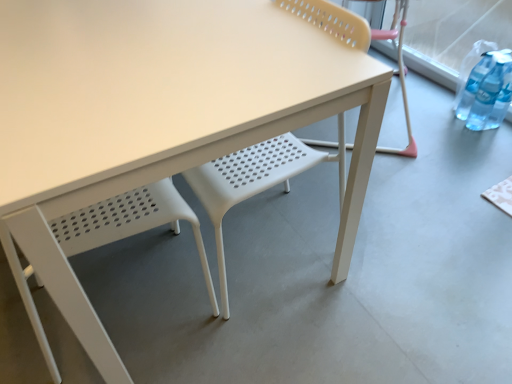
This screenshot has height=384, width=512. What do you see at coordinates (399, 75) in the screenshot?
I see `matte plastic chair at right, acting as the 2th chair starting from the left` at bounding box center [399, 75].

This screenshot has width=512, height=384. In order to click on matte plastic chair at right, acting as the 2th chair starting from the left in this screenshot , I will do `click(399, 75)`.

The image size is (512, 384). What do you see at coordinates (118, 238) in the screenshot?
I see `white plastic chair at lower left, which ranks as the 2th chair in back-to-front order` at bounding box center [118, 238].

Find the location of a particular element. The image size is (512, 384). white plastic chair at lower left, positioned as the 1th chair in bottom-to-top order is located at coordinates (118, 238).

This screenshot has width=512, height=384. Identify the location of matte plastic chair at right, the 1th chair in the right-to-left sequence. (399, 75).

Can you confirm if matte plastic chair at right, acting as the 2th chair starting from the left, is positioned to the left of white plastic chair at lower left, acting as the 2th chair starting from the right?

No.

Considering the positions of objects matte plastic chair at right, positioned as the second chair in front-to-back order, and white plastic chair at lower left, which is the 2th chair in top-to-bottom order, in the image provided, who is behind, matte plastic chair at right, positioned as the second chair in front-to-back order, or white plastic chair at lower left, which is the 2th chair in top-to-bottom order,?

matte plastic chair at right, positioned as the second chair in front-to-back order, is further away from the camera.

Is point (397, 154) farther from camera compared to point (52, 275)?

Yes.

From the image's perspective, is matte plastic chair at right, the 1th chair in the right-to-left sequence, beneath white plastic chair at lower left, acting as the 2th chair starting from the right?

No, from the image's perspective, matte plastic chair at right, the 1th chair in the right-to-left sequence, is not below white plastic chair at lower left, acting as the 2th chair starting from the right.

From a real-world perspective, is matte plastic chair at right, which appears as the first chair when viewed from the back, physically located above or below white plastic chair at lower left, positioned as the 1th chair in bottom-to-top order?

matte plastic chair at right, which appears as the first chair when viewed from the back, is situated lower than white plastic chair at lower left, positioned as the 1th chair in bottom-to-top order, in the real world.

Which of these two, matte plastic chair at right, which is the second chair in bottom-to-top order, or white plastic chair at lower left, positioned as the 1th chair in bottom-to-top order, is thinner?

white plastic chair at lower left, positioned as the 1th chair in bottom-to-top order, is thinner.

From their relative heights in the image, would you say matte plastic chair at right, which is the second chair in bottom-to-top order, is taller or shorter than white plastic chair at lower left, the 1th chair in the left-to-right sequence?

matte plastic chair at right, which is the second chair in bottom-to-top order, is shorter than white plastic chair at lower left, the 1th chair in the left-to-right sequence.

Who is smaller, matte plastic chair at right, positioned as the second chair in front-to-back order, or white plastic chair at lower left, acting as the 2th chair starting from the right?

With smaller size is white plastic chair at lower left, acting as the 2th chair starting from the right.

Would you say white plastic chair at lower left, which is the 2th chair in top-to-bottom order, is part of matte plastic chair at right, which is the second chair in bottom-to-top order,'s contents?

That's incorrect, white plastic chair at lower left, which is the 2th chair in top-to-bottom order, is not inside matte plastic chair at right, which is the second chair in bottom-to-top order.

Are matte plastic chair at right, which is the second chair in bottom-to-top order, and white plastic chair at lower left, positioned as the 1th chair in bottom-to-top order, making contact?

No, matte plastic chair at right, which is the second chair in bottom-to-top order, is not next to white plastic chair at lower left, positioned as the 1th chair in bottom-to-top order.

Is matte plastic chair at right, which appears as the first chair when viewed from the back, turned away from white plastic chair at lower left, positioned as the 1th chair in bottom-to-top order?

No, white plastic chair at lower left, positioned as the 1th chair in bottom-to-top order, is not at the back of matte plastic chair at right, which appears as the first chair when viewed from the back.

Measure the distance from matte plastic chair at right, which appears as the first chair when viewed from the back, to white plastic chair at lower left, acting as the 2th chair starting from the right.

The distance of matte plastic chair at right, which appears as the first chair when viewed from the back, from white plastic chair at lower left, acting as the 2th chair starting from the right, is 4.27 feet.

The image size is (512, 384). What are the coordinates of `chair that appears above the matte plastic chair at right, positioned as the second chair in front-to-back order (from a real-world perspective)` in the screenshot? It's located at (118, 238).

Based on their positions, is white plastic chair at lower left, which appears as the first chair when viewed from the front, located to the left or right of matte plastic chair at right, the 1th chair in the right-to-left sequence?

white plastic chair at lower left, which appears as the first chair when viewed from the front, is positioned on matte plastic chair at right, the 1th chair in the right-to-left sequence,'s left side.

Is the position of white plastic chair at lower left, which is the 2th chair in top-to-bottom order, more distant than that of matte plastic chair at right, the 1th chair in the right-to-left sequence?

No, it is in front of matte plastic chair at right, the 1th chair in the right-to-left sequence.

Which is further, (x=41, y=241) or (x=393, y=150)?

Point (x=393, y=150)

From the image's perspective, which is below, white plastic chair at lower left, positioned as the 1th chair in bottom-to-top order, or matte plastic chair at right, which appears as the first chair when viewed from the back?

white plastic chair at lower left, positioned as the 1th chair in bottom-to-top order, appears lower in the image.

From a real-world perspective, is white plastic chair at lower left, acting as the 2th chair starting from the right, below matte plastic chair at right, the 1th chair in the right-to-left sequence?

No, from a real-world perspective, white plastic chair at lower left, acting as the 2th chair starting from the right, is not beneath matte plastic chair at right, the 1th chair in the right-to-left sequence.

Is white plastic chair at lower left, the 1th chair in the left-to-right sequence, thinner than matte plastic chair at right, positioned as the second chair in front-to-back order?

Correct, the width of white plastic chair at lower left, the 1th chair in the left-to-right sequence, is less than that of matte plastic chair at right, positioned as the second chair in front-to-back order.

Considering the relative sizes of white plastic chair at lower left, which ranks as the 2th chair in back-to-front order, and matte plastic chair at right, positioned as the second chair in front-to-back order, in the image provided, is white plastic chair at lower left, which ranks as the 2th chair in back-to-front order, shorter than matte plastic chair at right, positioned as the second chair in front-to-back order,?

In fact, white plastic chair at lower left, which ranks as the 2th chair in back-to-front order, may be taller than matte plastic chair at right, positioned as the second chair in front-to-back order.

Is white plastic chair at lower left, which is the 2th chair in top-to-bottom order, bigger than matte plastic chair at right, acting as the 2th chair starting from the left?

No.

Does white plastic chair at lower left, positioned as the 1th chair in bottom-to-top order, contain matte plastic chair at right, acting as the 2th chair starting from the left?

No, matte plastic chair at right, acting as the 2th chair starting from the left, is not inside white plastic chair at lower left, positioned as the 1th chair in bottom-to-top order.

Is the surface of white plastic chair at lower left, which is the 2th chair in top-to-bottom order, in direct contact with matte plastic chair at right, which is the second chair in bottom-to-top order?

No.

Consider the image. Could you tell me if white plastic chair at lower left, the 1th chair in the left-to-right sequence, is turned towards matte plastic chair at right, positioned as the second chair in front-to-back order?

Yes, white plastic chair at lower left, the 1th chair in the left-to-right sequence, faces towards matte plastic chair at right, positioned as the second chair in front-to-back order.

Identify the location of chair behind the white plastic chair at lower left, which appears as the first chair when viewed from the front. (399, 75).

Locate an element on the screen. This screenshot has width=512, height=384. chair in front of the matte plastic chair at right, the 1th chair in the right-to-left sequence is located at coordinates pos(118,238).

Where is `chair behind the white plastic chair at lower left, which is the 2th chair in top-to-bottom order`? The height and width of the screenshot is (384, 512). chair behind the white plastic chair at lower left, which is the 2th chair in top-to-bottom order is located at coordinates (399, 75).